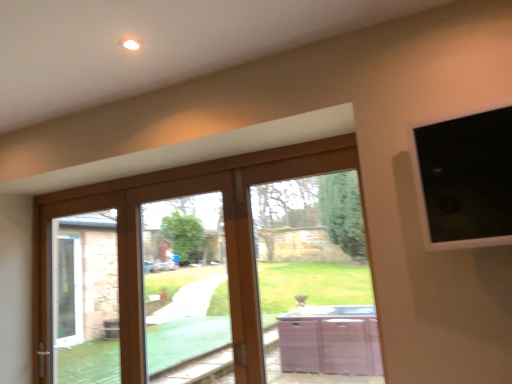
Question: Is wooden glass door at center with black glass at upper right?

Choices:
 (A) yes
 (B) no

Answer: (B)

Question: Is wooden glass door at center bigger than black glass at upper right?

Choices:
 (A) yes
 (B) no

Answer: (A)

Question: Is wooden glass door at center outside black glass at upper right?

Choices:
 (A) no
 (B) yes

Answer: (B)

Question: Can you confirm if wooden glass door at center is positioned to the right of black glass at upper right?

Choices:
 (A) no
 (B) yes

Answer: (A)

Question: From the image's perspective, is wooden glass door at center located beneath black glass at upper right?

Choices:
 (A) yes
 (B) no

Answer: (A)

Question: Is wooden glass door at center not close to black glass at upper right?

Choices:
 (A) yes
 (B) no

Answer: (A)

Question: Is black glass at upper right in front of brown wooden bay window at center?

Choices:
 (A) no
 (B) yes

Answer: (B)

Question: Are black glass at upper right and brown wooden bay window at center far apart?

Choices:
 (A) no
 (B) yes

Answer: (B)

Question: From a real-world perspective, is black glass at upper right on top of brown wooden bay window at center?

Choices:
 (A) no
 (B) yes

Answer: (B)

Question: Can you confirm if black glass at upper right is positioned to the left of brown wooden bay window at center?

Choices:
 (A) yes
 (B) no

Answer: (B)

Question: Considering the relative sizes of black glass at upper right and brown wooden bay window at center in the image provided, is black glass at upper right shorter than brown wooden bay window at center?

Choices:
 (A) no
 (B) yes

Answer: (B)

Question: Does black glass at upper right have a smaller size compared to brown wooden bay window at center?

Choices:
 (A) no
 (B) yes

Answer: (B)

Question: From the image's perspective, is clear glass door at center under black glass at upper right?

Choices:
 (A) no
 (B) yes

Answer: (B)